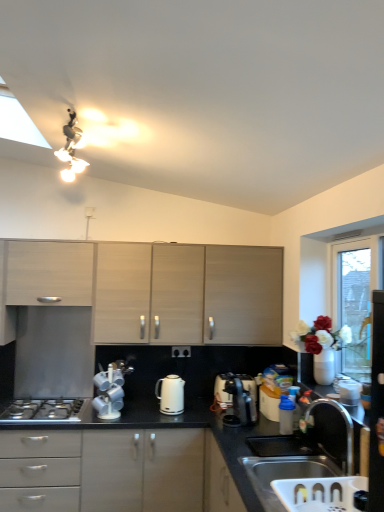
Where is `satin silver coffee machine at lower center, which is the 2th coffee machine from left to right`? Image resolution: width=384 pixels, height=512 pixels. satin silver coffee machine at lower center, which is the 2th coffee machine from left to right is located at coordinates (237, 396).

What is the approximate width of satin nickel faucet at sink right?

satin nickel faucet at sink right is 8.61 inches wide.

What is the approximate width of white glossy kettle at upper center, which appears as the third appliance when viewed from the back?

3.72 inches.

At what (x,y) coordinates should I click in order to perform the action: click on white glossy electric kettle at center. Please return your answer as a coordinate pair (x, y). The width and height of the screenshot is (384, 512). Looking at the image, I should click on (170, 394).

Measure the distance between point (x=202, y=342) and camera.

10.37 feet.

How much space does white glossy toaster at lower right, the third appliance in the right-to-left sequence, occupy horizontally?

white glossy toaster at lower right, the third appliance in the right-to-left sequence, is 18.01 centimeters wide.

I want to click on black matte countertop at center, so click(129, 465).

What's the angular difference between black matte countertop at center and white glossy electric kettle at center's facing directions?

They differ by 0.00255 degrees in their facing directions.

Is black matte countertop at center aimed at white glossy electric kettle at center?

No, black matte countertop at center does not turn towards white glossy electric kettle at center.

From the picture: Is black matte countertop at center in front of or behind white glossy electric kettle at center in the image?

black matte countertop at center is in front of white glossy electric kettle at center.

Does black matte countertop at center contain white glossy electric kettle at center?

No, black matte countertop at center does not contain white glossy electric kettle at center.

Does point (206, 428) appear closer or farther from the camera than point (241, 403)?

Clearly, point (206, 428) is closer to the camera than point (241, 403).

Can you tell me how much black matte countertop at center and satin silver coffee machine at lower center, which is the first coffee machine in right-to-left order, differ in facing direction?

The angle between the facing direction of black matte countertop at center and the facing direction of satin silver coffee machine at lower center, which is the first coffee machine in right-to-left order, is 84.5 degrees.

Can you confirm if black matte countertop at center is bigger than satin silver coffee machine at lower center, which is the first coffee machine in right-to-left order?

Yes, black matte countertop at center is bigger than satin silver coffee machine at lower center, which is the first coffee machine in right-to-left order.

Looking at this image, which is more to the left, black matte countertop at center or satin silver coffee machine at lower center, which is the first coffee machine in right-to-left order?

Positioned to the left is black matte countertop at center.

Is black matte countertop at center taller or shorter than white glossy toaster at lower right, positioned as the 1th appliance in back-to-front order?

Clearly, black matte countertop at center is taller compared to white glossy toaster at lower right, positioned as the 1th appliance in back-to-front order.

Identify the location of appliance that is behind the black matte countertop at center. [x=269, y=403].

Which object is further away from the camera, black matte countertop at center or white glossy toaster at lower right, the third appliance in the right-to-left sequence?

white glossy toaster at lower right, the third appliance in the right-to-left sequence, is further away from the camera.

Could you tell me if black matte countertop at center is turned towards white glossy toaster at lower right, the third appliance in the right-to-left sequence?

No, black matte countertop at center does not turn towards white glossy toaster at lower right, the third appliance in the right-to-left sequence.

What's the angular difference between white glossy kettle at upper center, the third appliance viewed from the left, and transparent glass door at right's facing directions?

2.62 degrees.

Is white glossy kettle at upper center, the third appliance viewed from the left, positioned in front of transparent glass door at right?

That is False.

From a real-world perspective, is white glossy kettle at upper center, the third appliance viewed from the left, on transparent glass door at right?

No, from a real-world perspective, white glossy kettle at upper center, the third appliance viewed from the left, is not on top of transparent glass door at right.

Measure the distance between black matte countertop at center and satin nickel faucet at sink right.

They are 3.29 feet apart.

Choose the correct answer: Is black matte countertop at center inside satin nickel faucet at sink right or outside it?

black matte countertop at center is spatially situated outside satin nickel faucet at sink right.

From the image's perspective, which object appears higher, black matte countertop at center or satin nickel faucet at sink right?

satin nickel faucet at sink right.

From a real-world perspective, which is physically below, black matte countertop at center or satin nickel faucet at sink right?

black matte countertop at center.

Can you confirm if transparent glass door at right is taller than satin silver coffee machine at lower center, which is the first coffee machine in right-to-left order?

Indeed, transparent glass door at right has a greater height compared to satin silver coffee machine at lower center, which is the first coffee machine in right-to-left order.

Would you consider transparent glass door at right to be distant from satin silver coffee machine at lower center, which is the first coffee machine in right-to-left order?

Actually, transparent glass door at right and satin silver coffee machine at lower center, which is the first coffee machine in right-to-left order, are a little close together.

Which is correct: transparent glass door at right is inside satin silver coffee machine at lower center, which is the 2th coffee machine from left to right, or outside of it?

The correct answer is: outside.

Where is `window screen positioned vertically above the satin silver coffee machine at lower center, which is the 2th coffee machine from left to right (from a real-world perspective)`? window screen positioned vertically above the satin silver coffee machine at lower center, which is the 2th coffee machine from left to right (from a real-world perspective) is located at coordinates (356, 300).

From a real-world perspective, count 2nd cabinetrys upward from the white plastic coffee machine at center, marked as the second coffee machine in a right-to-left arrangement, and point to it. Please provide its 2D coordinates.

[(49, 272)]

Is matte wood cabinet at left, placed as the 1th cabinetry when sorted from left to right, placed right next to white plastic coffee machine at center, placed as the 1th coffee machine when sorted from left to right?

matte wood cabinet at left, placed as the 1th cabinetry when sorted from left to right, and white plastic coffee machine at center, placed as the 1th coffee machine when sorted from left to right, are clearly separated.

Which is in front, point (81, 247) or point (114, 388)?

The point (114, 388) is in front.

Considering the positions of objects matte wood cabinet at left, placed as the 1th cabinetry when sorted from left to right, and white plastic coffee machine at center, placed as the 1th coffee machine when sorted from left to right, in the image provided, who is more to the left, matte wood cabinet at left, placed as the 1th cabinetry when sorted from left to right, or white plastic coffee machine at center, placed as the 1th coffee machine when sorted from left to right,?

From the viewer's perspective, matte wood cabinet at left, placed as the 1th cabinetry when sorted from left to right, appears more on the left side.

Identify the location of kitchen appliance behind the black matte countertop at center. (170, 394).

You are a GUI agent. You are given a task and a screenshot of the screen. Output one action in this format:
    pyautogui.click(x=<x>, y=<y>)
    Task: Click on the countertop below the satin silver coffee machine at lower center, which is the first coffee machine in right-to-left order (from a real-world perspective)
    This screenshot has height=512, width=384.
    Given the screenshot: What is the action you would take?
    pyautogui.click(x=129, y=465)

From the image, which object appears to be farther from silver metallic gas stove at lower left, matte wood cabinet at left, placed as the 1th cabinetry when sorted from left to right, or satin silver coffee machine at lower center, which is the first coffee machine in right-to-left order?

Among the two, satin silver coffee machine at lower center, which is the first coffee machine in right-to-left order, is located further to silver metallic gas stove at lower left.

Consider the image. Based on their spatial positions, is blue plastic container at lower right, the 2th appliance in the back-to-front sequence, or satin nickel faucet at sink right closer to satin silver coffee machine at lower center, which is the first coffee machine in right-to-left order?

blue plastic container at lower right, the 2th appliance in the back-to-front sequence.

Estimate the real-world distances between objects in this image. Which object is further from satin nickel faucet at sink right, white glossy toaster at lower right, the third appliance in the right-to-left sequence, or blue plastic container at lower right, the 2th appliance in the back-to-front sequence?

white glossy toaster at lower right, the third appliance in the right-to-left sequence, is further to satin nickel faucet at sink right.

Looking at the image, which one is located closer to white glossy kettle at upper center, which ranks as the first appliance in front-to-back order, blue plastic container at lower right, which ranks as the 2th appliance in front-to-back order, or white glossy electric kettle at center?

blue plastic container at lower right, which ranks as the 2th appliance in front-to-back order, is positioned closer to the anchor white glossy kettle at upper center, which ranks as the first appliance in front-to-back order.

Considering their positions, is white glossy electric kettle at center positioned closer to transparent glass door at right than satin nickel faucet at sink right?

Among the two, satin nickel faucet at sink right is located nearer to transparent glass door at right.

When comparing their distances from white glossy electric kettle at center, does black matte countertop at center or white plastic coffee machine at center, marked as the second coffee machine in a right-to-left arrangement, seem further?

Based on the image, black matte countertop at center appears to be further to white glossy electric kettle at center.

When comparing their distances from white glossy toaster at lower right, positioned as the 1th appliance in back-to-front order, does satin silver coffee machine at lower center, which is the first coffee machine in right-to-left order, or satin nickel faucet at sink right seem closer?

Based on the image, satin silver coffee machine at lower center, which is the first coffee machine in right-to-left order, appears to be nearer to white glossy toaster at lower right, positioned as the 1th appliance in back-to-front order.

Based on their spatial positions, is matte wood cabinets at center, which ranks as the 1th cabinetry in right-to-left order, or black matte countertop at center closer to white plastic coffee machine at center, placed as the 1th coffee machine when sorted from left to right?

Among the two, black matte countertop at center is located nearer to white plastic coffee machine at center, placed as the 1th coffee machine when sorted from left to right.

This screenshot has width=384, height=512. What are the coordinates of `cabinetry between white plastic coffee machine at center, placed as the 1th coffee machine when sorted from left to right, and white glossy kettle at upper center, which ranks as the first appliance in front-to-back order, from left to right` in the screenshot? It's located at (153, 289).

At what (x,y) coordinates should I click in order to perform the action: click on kitchen appliance between silver metallic gas stove at lower left and satin silver coffee machine at lower center, which is the 2th coffee machine from left to right, in the horizontal direction. Please return your answer as a coordinate pair (x, y). The height and width of the screenshot is (512, 384). Looking at the image, I should click on (170, 394).

You are a GUI agent. You are given a task and a screenshot of the screen. Output one action in this format:
    pyautogui.click(x=<x>, y=<y>)
    Task: Click on the tap between matte wood cabinet at left, which appears as the 2th cabinetry when viewed from the right, and transparent glass door at right from left to right
    Image resolution: width=384 pixels, height=512 pixels.
    Given the screenshot: What is the action you would take?
    (346, 426)

The height and width of the screenshot is (512, 384). In order to click on kitchen appliance between white plastic coffee machine at center, marked as the second coffee machine in a right-to-left arrangement, and satin silver coffee machine at lower center, which is the 2th coffee machine from left to right in this screenshot , I will do `click(170, 394)`.